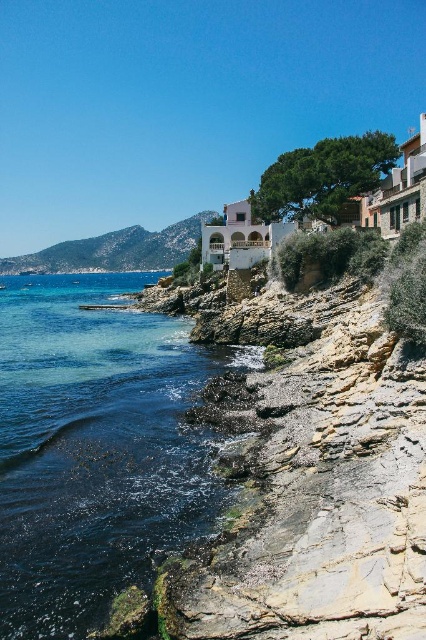
Question: Is clear blue water at lower left smaller than green grassy hillside at upper left?

Choices:
 (A) no
 (B) yes

Answer: (B)

Question: Among these objects, which one is nearest to the camera?

Choices:
 (A) clear blue water at lower left
 (B) green grassy hillside at upper left

Answer: (A)

Question: Considering the relative positions of clear blue water at lower left and green grassy hillside at upper left in the image provided, where is clear blue water at lower left located with respect to green grassy hillside at upper left?

Choices:
 (A) above
 (B) below

Answer: (B)

Question: Can you confirm if clear blue water at lower left is bigger than green grassy hillside at upper left?

Choices:
 (A) no
 (B) yes

Answer: (A)